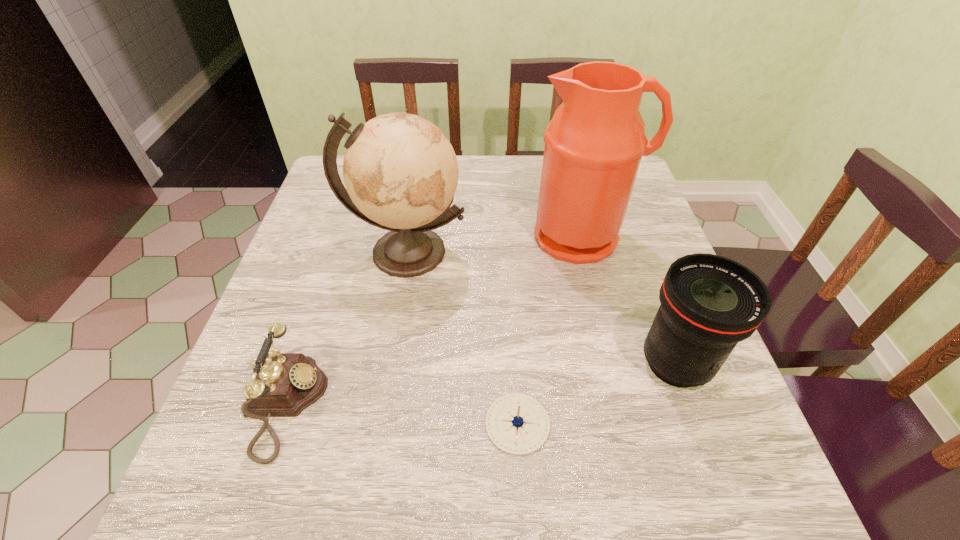
Identify the location of vacant area situated 0.310m on the left of the compass. The height and width of the screenshot is (540, 960). click(x=306, y=424).

This screenshot has height=540, width=960. I want to click on object that is at the near edge, so click(x=283, y=384).

The width and height of the screenshot is (960, 540). I want to click on globe that is positioned at the left edge, so click(x=400, y=171).

At what (x,y) coordinates should I click in order to perform the action: click on telephone at the left edge. Please return your answer as a coordinate pair (x, y). Looking at the image, I should click on (283, 384).

Locate an element on the screen. The height and width of the screenshot is (540, 960). water jug located in the right edge section of the desktop is located at coordinates (594, 143).

Image resolution: width=960 pixels, height=540 pixels. I want to click on telephoto lens that is at the right edge, so click(x=709, y=303).

Locate an element on the screen. object that is positioned at the near left corner is located at coordinates (283, 384).

The image size is (960, 540). In the image, there is a desktop. What are the coordinates of `free space at the far edge` in the screenshot? It's located at (504, 198).

You are a GUI agent. You are given a task and a screenshot of the screen. Output one action in this format:
    pyautogui.click(x=<x>, y=<y>)
    Task: Click on the free space at the left edge of the desktop
    The height and width of the screenshot is (540, 960).
    Given the screenshot: What is the action you would take?
    pyautogui.click(x=367, y=228)

Locate an element on the screen. This screenshot has height=540, width=960. vacant area at the far left corner is located at coordinates (337, 202).